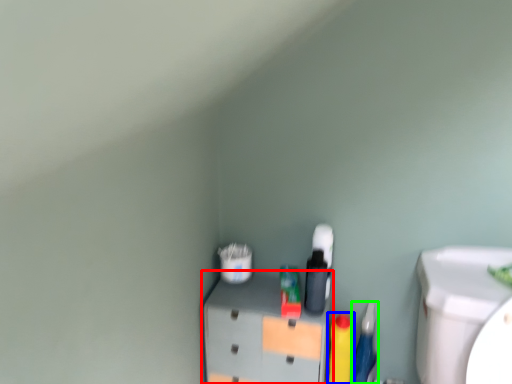
Question: Which object is the closest to the furniture (highlighted by a red box)? Choose among these: cleaning product (highlighted by a blue box) or stationery (highlighted by a green box).

Choices:
 (A) cleaning product
 (B) stationery

Answer: (A)